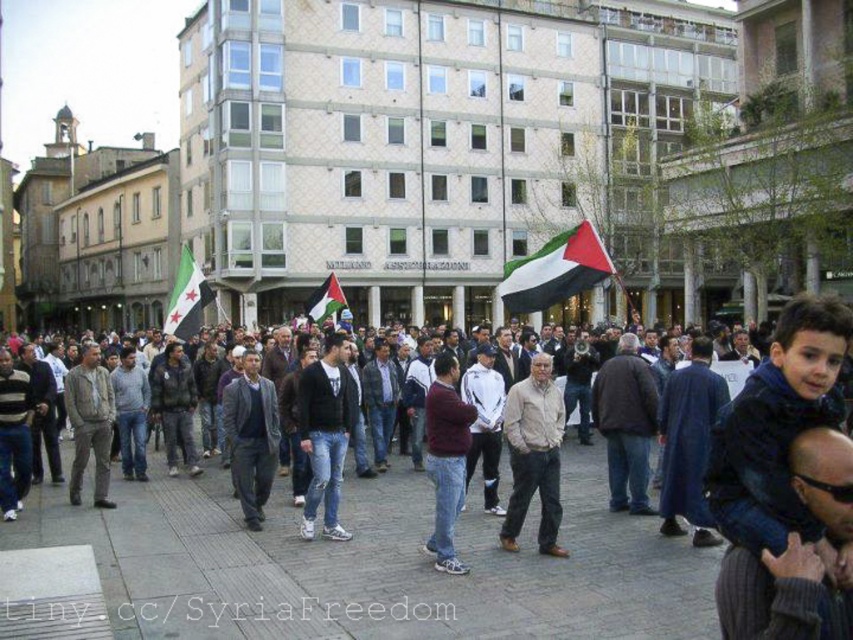
Which is behind, point (508, 282) or point (78, 380)?

The point (508, 282) is behind.

Does white matte flag at center have a larger size compared to dark gray jacket at center?

Indeed, white matte flag at center has a larger size compared to dark gray jacket at center.

Locate an element on the screen. This screenshot has height=640, width=853. white matte flag at center is located at coordinates 555,269.

I want to click on white matte flag at center, so click(x=555, y=269).

Who is shorter, dark gray wool sweater at center or dark gray jacket at center?

With less height is dark gray wool sweater at center.

Consider the image. Is dark gray wool sweater at center behind dark gray jacket at center?

No, it is not.

Is point (231, 436) positioned before point (73, 385)?

Yes, point (231, 436) is closer to viewer.

You are a GUI agent. You are given a task and a screenshot of the screen. Output one action in this format:
    pyautogui.click(x=<x>, y=<y>)
    Task: Click on the dark gray wool sweater at center
    
    Given the screenshot: What is the action you would take?
    pyautogui.click(x=251, y=436)

Which is more to the right, dark blue sweater at lower right or dark gray jacket at center?

dark blue sweater at lower right is more to the right.

The image size is (853, 640). Find the location of `dark blue sweater at lower right`. dark blue sweater at lower right is located at coordinates (781, 595).